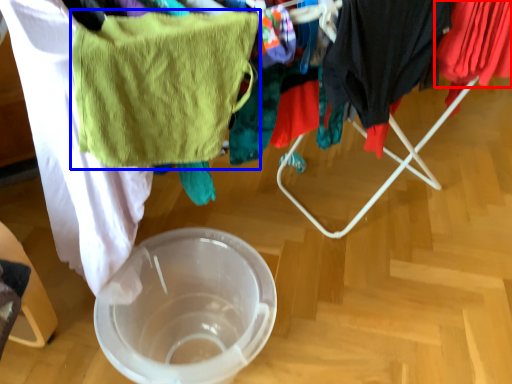
Question: Among these objects, which one is farthest to the camera, clothing (highlighted by a red box) or towel/napkin (highlighted by a blue box)?

Choices:
 (A) clothing
 (B) towel/napkin

Answer: (A)